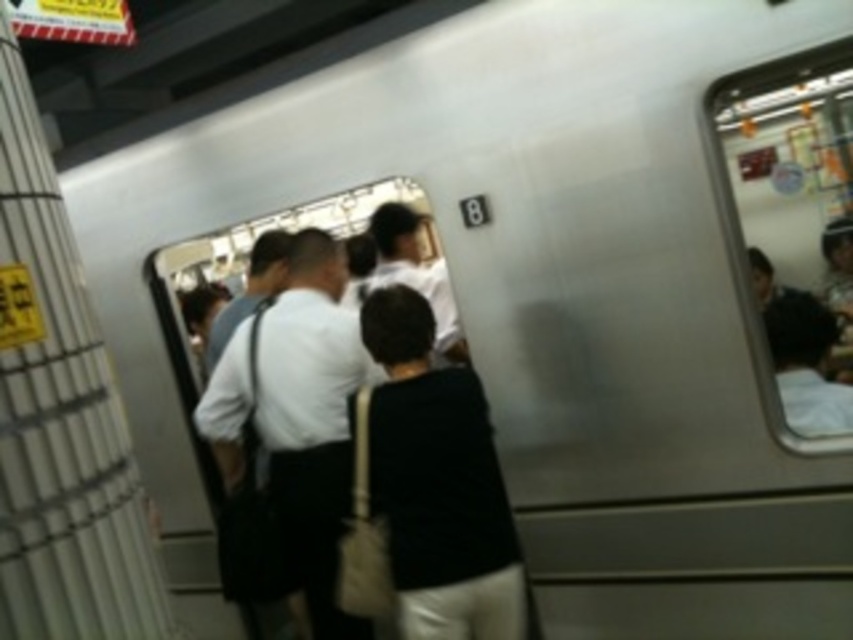
Looking at this image, which is below, black fabric bag at center or white matte shirt at center?

black fabric bag at center is lower down.

Which is more to the left, black fabric bag at center or white matte shirt at center?

From the viewer's perspective, white matte shirt at center appears more on the left side.

Which is in front, point (381, 307) or point (264, 372)?

Point (381, 307) is in front.

This screenshot has height=640, width=853. I want to click on black fabric bag at center, so click(438, 483).